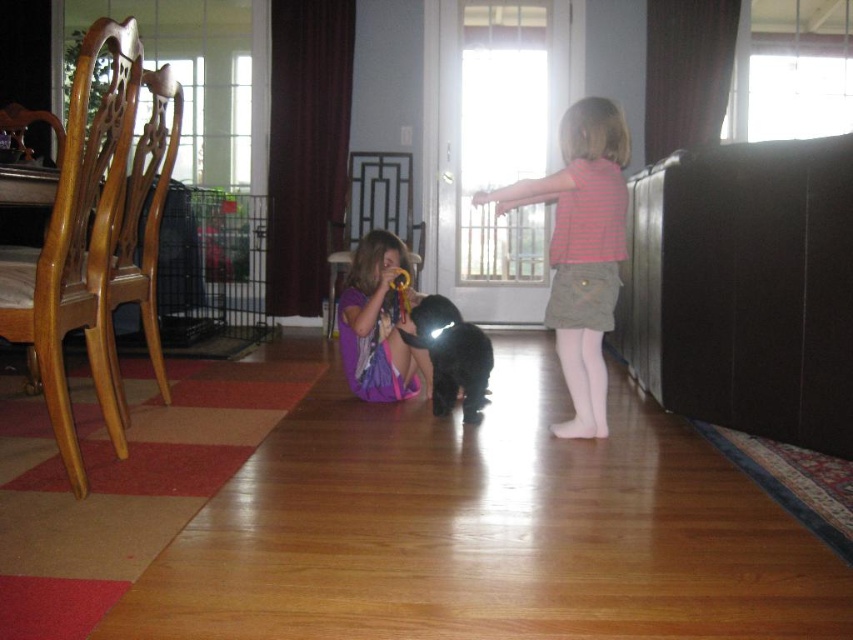
You are a parent trying to decide which item to place in a narrow hallway. The hallway is just wide enough to fit either the matte purple dress at center or the black fur dog at center. Based on their widths, which item can you fit through the hallway?

The matte purple dress at center is wider than the black fur dog at center. Since the hallway can only fit one of them, the black fur dog at center would be the one that can fit through the hallway.